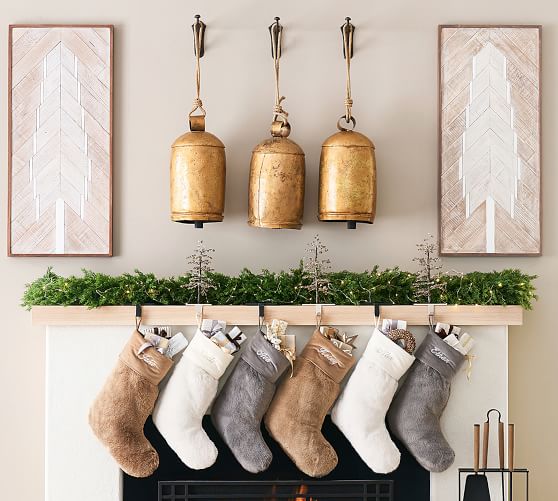
You are a GUI agent. You are given a task and a screenshot of the screen. Output one action in this format:
    pyautogui.click(x=<x>, y=<y>)
    Task: Click on the fireplace tools
    
    Given the screenshot: What is the action you would take?
    pyautogui.click(x=478, y=472), pyautogui.click(x=506, y=448)